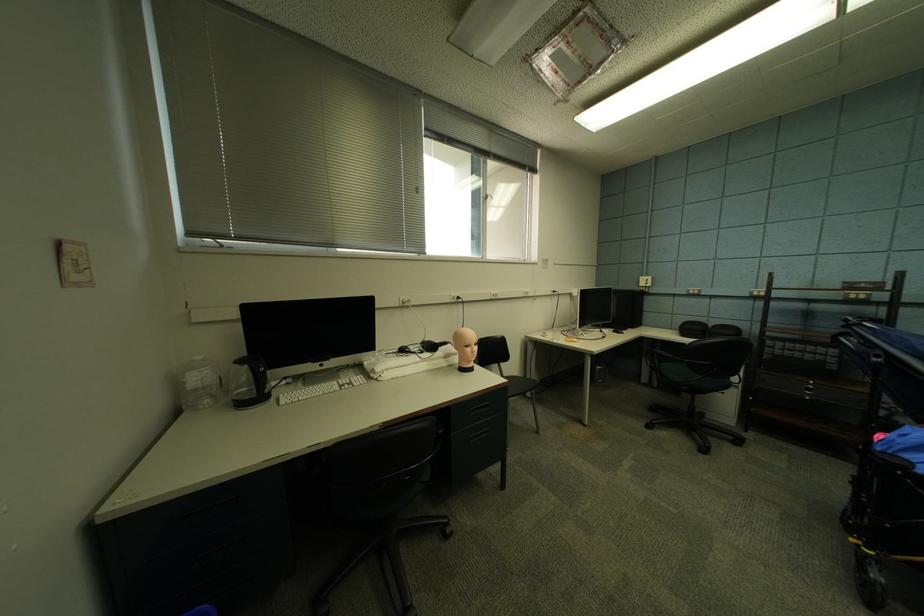
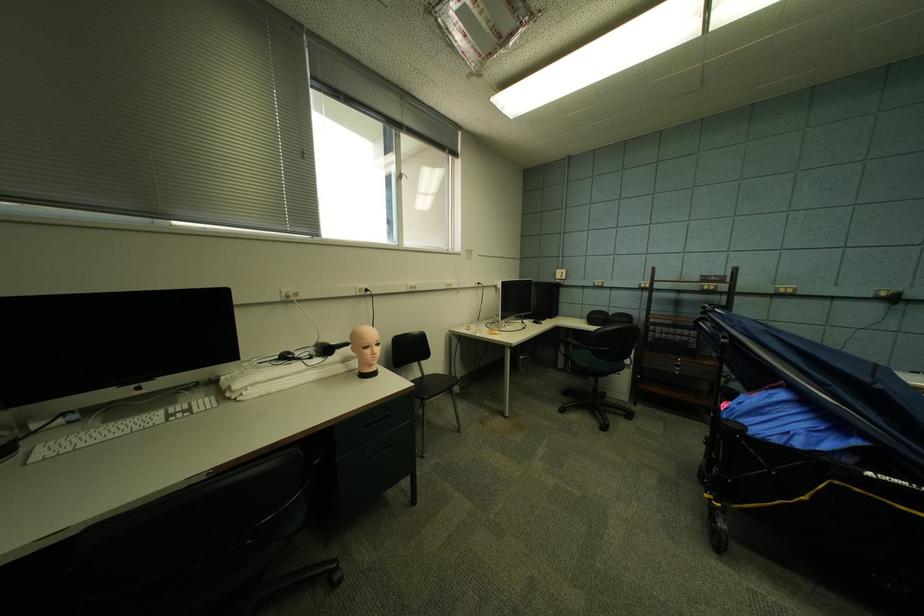
Which direction would the cameraman need to move to produce the second image?

The cameraman walked toward right, forward.